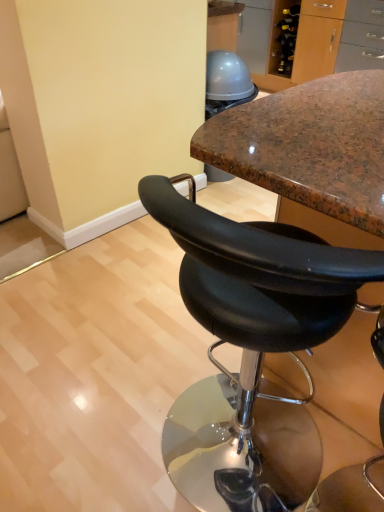
The width and height of the screenshot is (384, 512). I want to click on black leather stool at center, which is counted as the 2th chair, starting from the right, so click(x=351, y=489).

The height and width of the screenshot is (512, 384). Describe the element at coordinates (351, 489) in the screenshot. I see `black leather stool at center, marked as the 1th chair in a left-to-right arrangement` at that location.

Measure the distance between point (383, 440) and camera.

Point (383, 440) is 4.26 feet from camera.

What do you see at coordinates (251, 349) in the screenshot?
I see `black leather stool at center, which appears as the second chair when viewed from the left` at bounding box center [251, 349].

Where is `black leather stool at center, which appears as the second chair when viewed from the left`? The image size is (384, 512). black leather stool at center, which appears as the second chair when viewed from the left is located at coordinates click(251, 349).

Find the location of a particular element. Image resolution: width=384 pixels, height=512 pixels. black leather stool at center, which is counted as the 2th chair, starting from the right is located at coordinates (351, 489).

In the image, is black leather stool at center, which is the 1th chair in right-to-left order, on the left side or the right side of black leather stool at center, marked as the 1th chair in a left-to-right arrangement?

Based on their positions, black leather stool at center, which is the 1th chair in right-to-left order, is located to the right of black leather stool at center, marked as the 1th chair in a left-to-right arrangement.

Is black leather stool at center, which is the 1th chair in right-to-left order, in front of or behind black leather stool at center, which is counted as the 2th chair, starting from the right, in the image?

In the image, black leather stool at center, which is the 1th chair in right-to-left order, appears behind black leather stool at center, which is counted as the 2th chair, starting from the right.

Is point (275, 420) more distant than point (369, 501)?

Yes, it is.

From the image's perspective, which one is positioned lower, black leather stool at center, which is the 1th chair in right-to-left order, or black leather stool at center, marked as the 1th chair in a left-to-right arrangement?

black leather stool at center, marked as the 1th chair in a left-to-right arrangement, from the image's perspective.

Looking at this image, from a real-world perspective, who is located higher, black leather stool at center, which appears as the second chair when viewed from the left, or black leather stool at center, marked as the 1th chair in a left-to-right arrangement?

black leather stool at center, which appears as the second chair when viewed from the left, from a real-world perspective.

Considering the sizes of objects black leather stool at center, which is the 1th chair in right-to-left order, and black leather stool at center, marked as the 1th chair in a left-to-right arrangement, in the image provided, who is thinner, black leather stool at center, which is the 1th chair in right-to-left order, or black leather stool at center, marked as the 1th chair in a left-to-right arrangement,?

black leather stool at center, marked as the 1th chair in a left-to-right arrangement, is thinner.

Considering the sizes of objects black leather stool at center, which is the 1th chair in right-to-left order, and black leather stool at center, marked as the 1th chair in a left-to-right arrangement, in the image provided, who is shorter, black leather stool at center, which is the 1th chair in right-to-left order, or black leather stool at center, marked as the 1th chair in a left-to-right arrangement,?

black leather stool at center, marked as the 1th chair in a left-to-right arrangement.

In terms of size, does black leather stool at center, which is the 1th chair in right-to-left order, appear bigger or smaller than black leather stool at center, which is counted as the 2th chair, starting from the right?

Clearly, black leather stool at center, which is the 1th chair in right-to-left order, is larger in size than black leather stool at center, which is counted as the 2th chair, starting from the right.

Would you say black leather stool at center, marked as the 1th chair in a left-to-right arrangement, is part of black leather stool at center, which appears as the second chair when viewed from the left,'s contents?

Yes, black leather stool at center, marked as the 1th chair in a left-to-right arrangement, is a part of black leather stool at center, which appears as the second chair when viewed from the left.

Is black leather stool at center, which is the 1th chair in right-to-left order, positioned far away from black leather stool at center, which is counted as the 2th chair, starting from the right?

No, black leather stool at center, which is the 1th chair in right-to-left order, is in close proximity to black leather stool at center, which is counted as the 2th chair, starting from the right.

Is black leather stool at center, which appears as the second chair when viewed from the left, facing away from black leather stool at center, marked as the 1th chair in a left-to-right arrangement?

Yes.

Can you tell me how much black leather stool at center, which is the 1th chair in right-to-left order, and black leather stool at center, marked as the 1th chair in a left-to-right arrangement, differ in facing direction?

They differ by 1.57 degrees in their facing directions.

You are a GUI agent. You are given a task and a screenshot of the screen. Output one action in this format:
    pyautogui.click(x=<x>, y=<y>)
    Task: Click on the chair below the black leather stool at center, which is the 1th chair in right-to-left order (from a real-world perspective)
    The height and width of the screenshot is (512, 384).
    Given the screenshot: What is the action you would take?
    pyautogui.click(x=351, y=489)

Between black leather stool at center, marked as the 1th chair in a left-to-right arrangement, and black leather stool at center, which is the 1th chair in right-to-left order, which one appears on the left side from the viewer's perspective?

Positioned to the left is black leather stool at center, marked as the 1th chair in a left-to-right arrangement.

Is black leather stool at center, marked as the 1th chair in a left-to-right arrangement, positioned before black leather stool at center, which appears as the second chair when viewed from the left?

Yes, black leather stool at center, marked as the 1th chair in a left-to-right arrangement, is in front of black leather stool at center, which appears as the second chair when viewed from the left.

Is point (318, 492) positioned after point (236, 301)?

Yes.

From the image's perspective, is black leather stool at center, marked as the 1th chair in a left-to-right arrangement, positioned above or below black leather stool at center, which appears as the second chair when viewed from the left?

black leather stool at center, marked as the 1th chair in a left-to-right arrangement, is situated lower than black leather stool at center, which appears as the second chair when viewed from the left, in the image.

From a real-world perspective, is black leather stool at center, marked as the 1th chair in a left-to-right arrangement, physically located above or below black leather stool at center, which is the 1th chair in right-to-left order?

black leather stool at center, marked as the 1th chair in a left-to-right arrangement, is situated lower than black leather stool at center, which is the 1th chair in right-to-left order, in the real world.

Can you confirm if black leather stool at center, marked as the 1th chair in a left-to-right arrangement, is thinner than black leather stool at center, which is the 1th chair in right-to-left order?

Yes.

Is black leather stool at center, marked as the 1th chair in a left-to-right arrangement, taller than black leather stool at center, which appears as the second chair when viewed from the left?

No.

Is black leather stool at center, marked as the 1th chair in a left-to-right arrangement, bigger or smaller than black leather stool at center, which is the 1th chair in right-to-left order?

black leather stool at center, marked as the 1th chair in a left-to-right arrangement, is smaller than black leather stool at center, which is the 1th chair in right-to-left order.

Is black leather stool at center, which appears as the second chair when viewed from the left, located within black leather stool at center, marked as the 1th chair in a left-to-right arrangement?

Actually, black leather stool at center, which appears as the second chair when viewed from the left, is outside black leather stool at center, marked as the 1th chair in a left-to-right arrangement.

Are black leather stool at center, which is counted as the 2th chair, starting from the right, and black leather stool at center, which is the 1th chair in right-to-left order, far apart?

black leather stool at center, which is counted as the 2th chair, starting from the right, is near black leather stool at center, which is the 1th chair in right-to-left order, not far away.

Is black leather stool at center, which is counted as the 2th chair, starting from the right, positioned with its back to black leather stool at center, which is the 1th chair in right-to-left order?

Yes, black leather stool at center, which is counted as the 2th chair, starting from the right, is positioned with its back facing black leather stool at center, which is the 1th chair in right-to-left order.

How many degrees apart are the facing directions of black leather stool at center, which is counted as the 2th chair, starting from the right, and black leather stool at center, which appears as the second chair when viewed from the left?

They differ by 1.57 degrees in their facing directions.

At what (x,y) coordinates should I click in order to perform the action: click on chair in front of the black leather stool at center, which is the 1th chair in right-to-left order. Please return your answer as a coordinate pair (x, y). Looking at the image, I should click on (351, 489).

I want to click on chair on the right of black leather stool at center, which is counted as the 2th chair, starting from the right, so click(251, 349).

At what (x,y) coordinates should I click in order to perform the action: click on chair above the black leather stool at center, marked as the 1th chair in a left-to-right arrangement (from a real-world perspective). Please return your answer as a coordinate pair (x, y). Looking at the image, I should click on (251, 349).